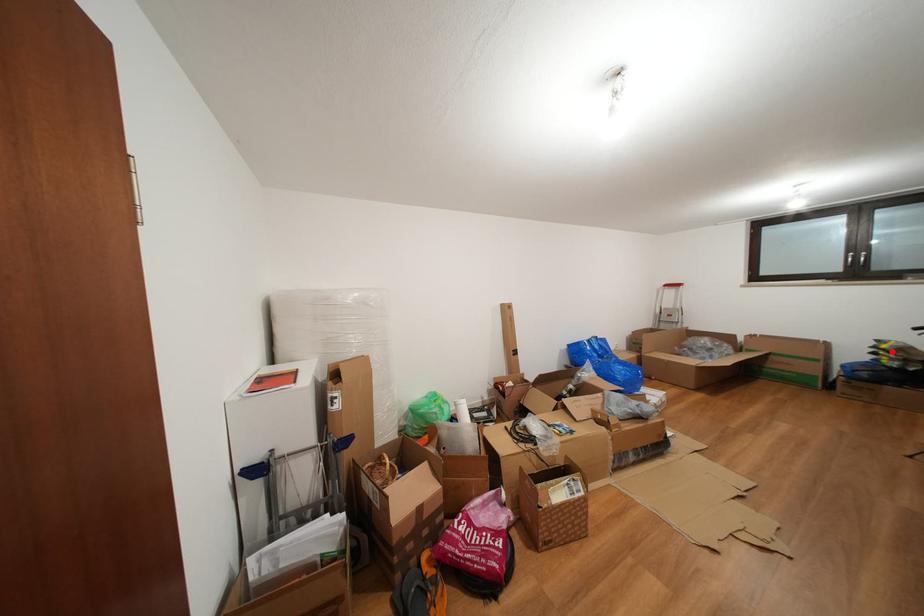
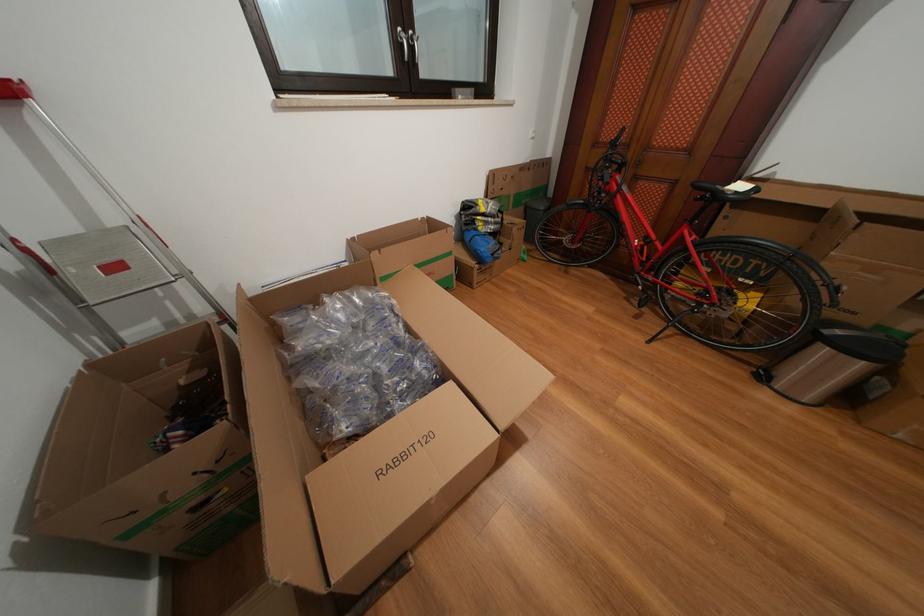
Find the pixel in the second image that matches the highlighted location in the first image.

(491, 215)